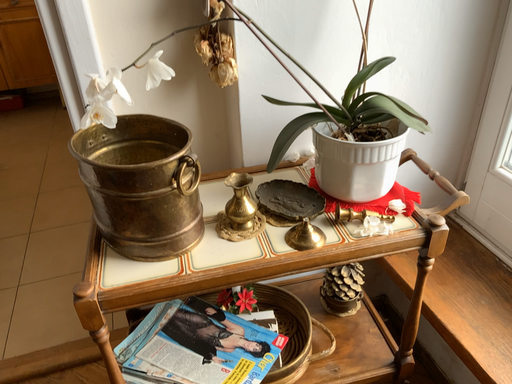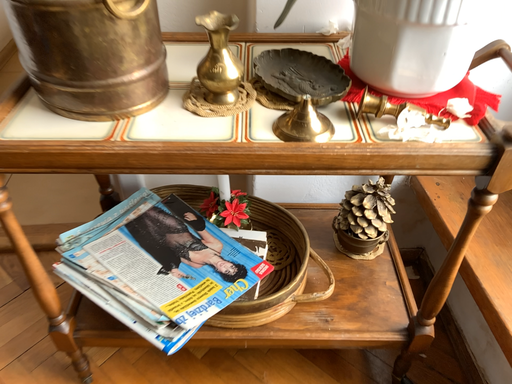
Question: How did the camera likely rotate when shooting the video?

Choices:
 (A) rotated left
 (B) rotated right

Answer: (A)